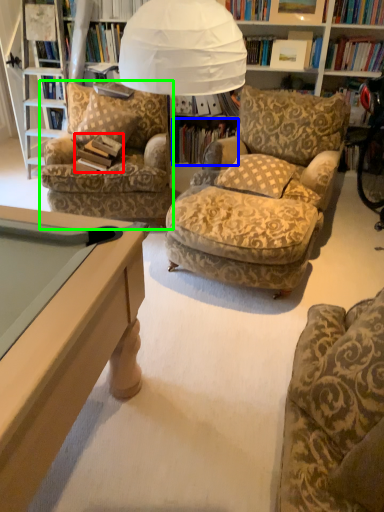
Question: Which object is positioned farthest from book (highlighted by a red box)? Select from book (highlighted by a blue box) and chair (highlighted by a green box).

Choices:
 (A) book
 (B) chair

Answer: (A)